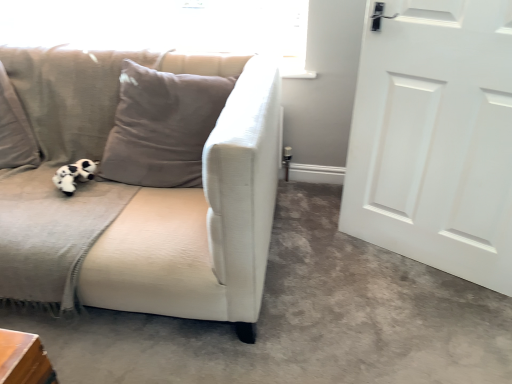
Question: Considering the relative positions of white matte door at right and transparent glass window screen at upper left in the image provided, is white matte door at right to the left or to the right of transparent glass window screen at upper left?

Choices:
 (A) right
 (B) left

Answer: (A)

Question: In the image, is white matte door at right positioned in front of or behind transparent glass window screen at upper left?

Choices:
 (A) behind
 (B) front

Answer: (B)

Question: Which is farther from the transparent glass window screen at upper left?

Choices:
 (A) white matte door at right
 (B) matte gray cushion at center
 (C) beige fabric couch at left
 (D) white fabric couch at left
 (E) black plush toy at left

Answer: (D)

Question: Which is nearer to the white matte door at right?

Choices:
 (A) transparent glass window screen at upper left
 (B) black plush toy at left
 (C) matte gray cushion at center
 (D) beige fabric couch at left
 (E) white fabric couch at left

Answer: (E)